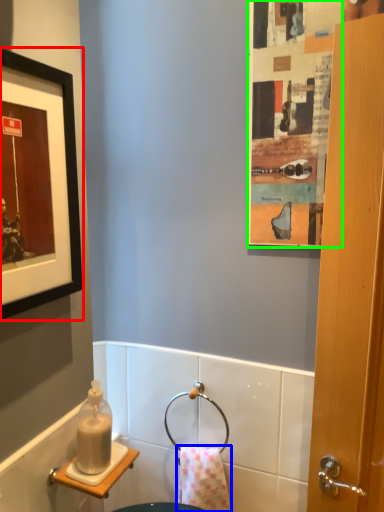
Question: Which object is positioned closest to picture frame (highlighted by a red box)? Select from towel/napkin (highlighted by a blue box) and poster (highlighted by a green box).

Choices:
 (A) towel/napkin
 (B) poster

Answer: (B)